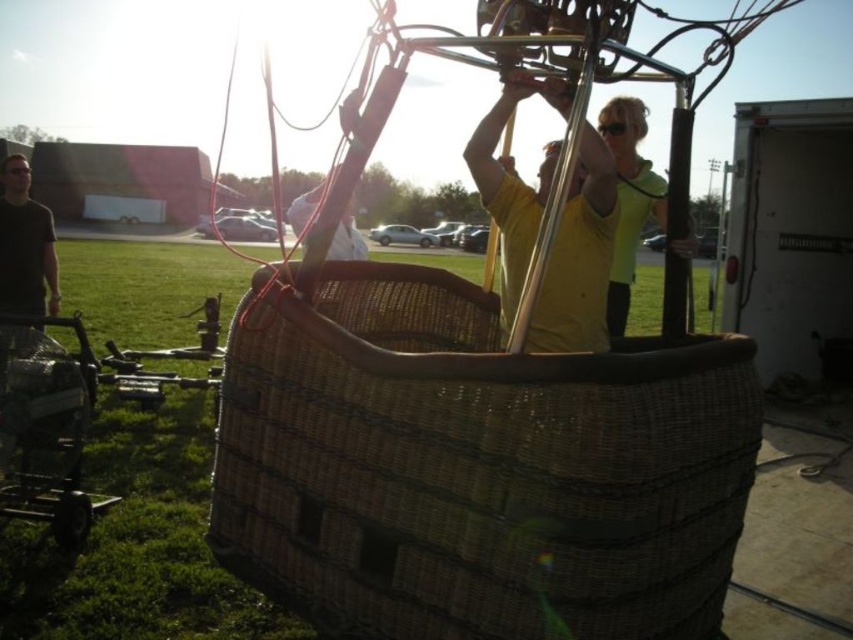
Question: Does yellow matte shirt at center appear on the right side of matte black shirt at left?

Choices:
 (A) no
 (B) yes

Answer: (B)

Question: Estimate the real-world distances between objects in this image. Which object is closer to the matte black shirt at left?

Choices:
 (A) yellow-green fabric at upper center
 (B) yellow matte shirt at center
 (C) woven brown basket at center

Answer: (B)

Question: Does woven brown basket at center appear under yellow matte shirt at center?

Choices:
 (A) no
 (B) yes

Answer: (B)

Question: Among these objects, which one is farthest from the camera?

Choices:
 (A) matte black shirt at left
 (B) yellow matte shirt at center

Answer: (A)

Question: Which point is farther to the camera?

Choices:
 (A) (675, 250)
 (B) (509, 298)
 (C) (33, 310)

Answer: (C)

Question: Is yellow matte shirt at center positioned in front of matte black shirt at left?

Choices:
 (A) yes
 (B) no

Answer: (A)